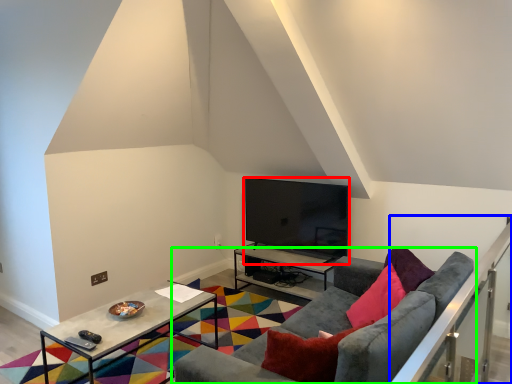
Question: Which object is the closest to the television (highlighted by a red box)? Choose among these: balustrade (highlighted by a blue box) or studio couch (highlighted by a green box).

Choices:
 (A) balustrade
 (B) studio couch

Answer: (B)